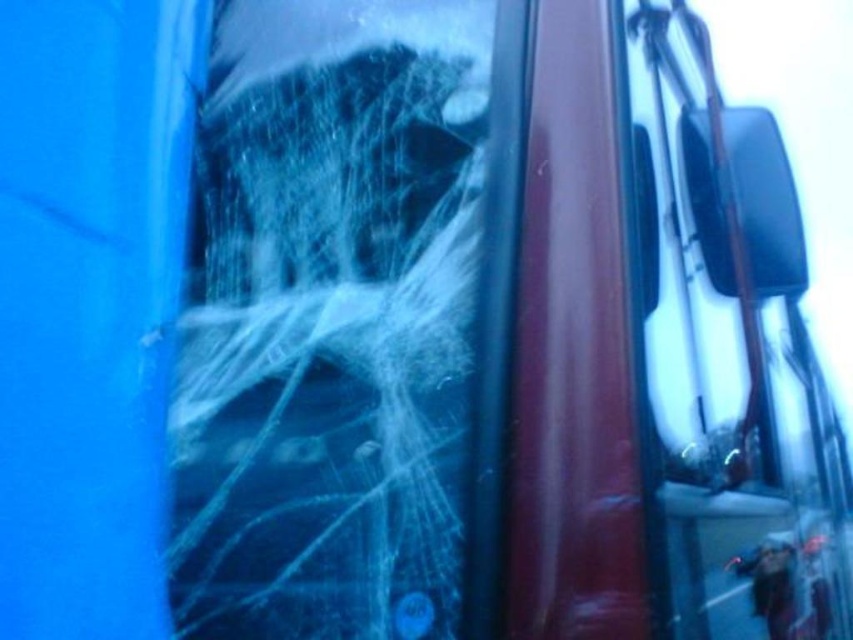
You are a police officer examining the damaged vehicle. You notice a white fibrous spider web at center in the image. Where exactly is this spider web located in relation to the vehicle?

The white fibrous spider web at center is located at point (329, 321) on the vehicle.